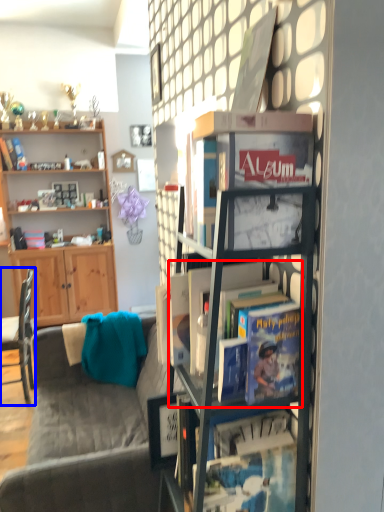
Question: Which of the following is the farthest to the observer, book (highlighted by a red box) or chair (highlighted by a blue box)?

Choices:
 (A) book
 (B) chair

Answer: (B)